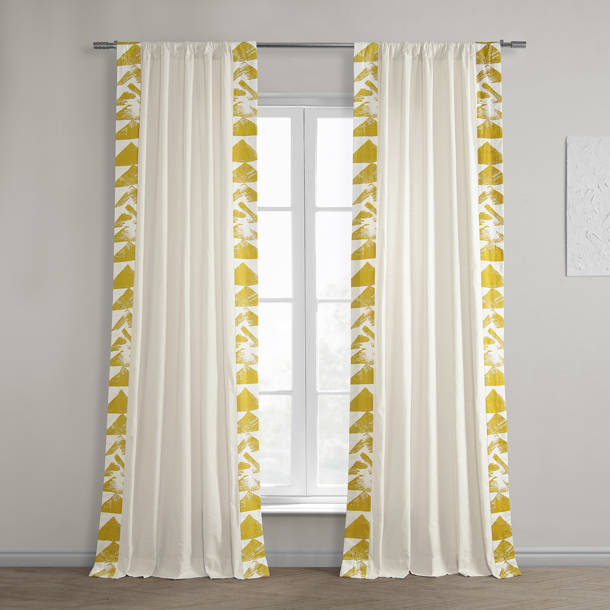
Locate an element on the screen. The width and height of the screenshot is (610, 610). right-hand section of curtains is located at coordinates (436, 332).